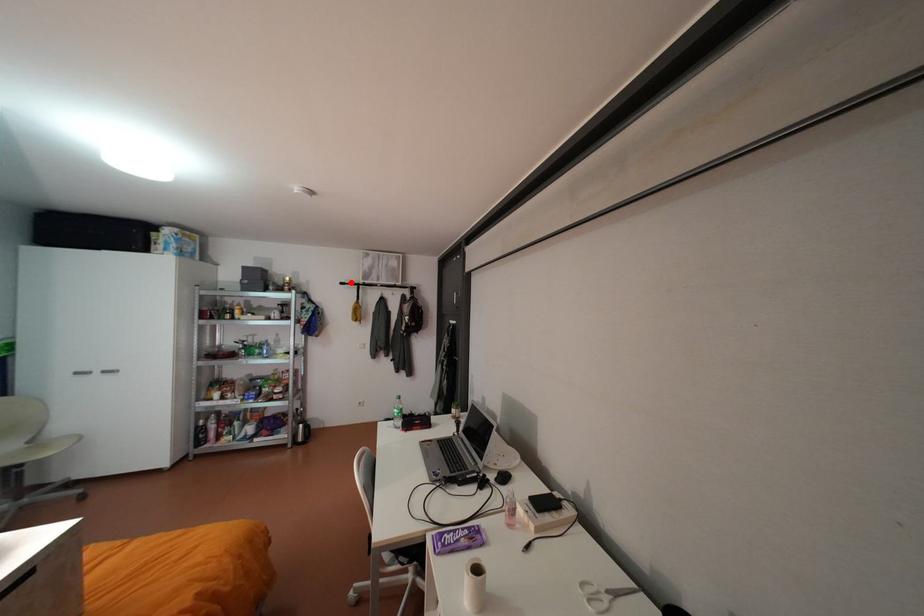
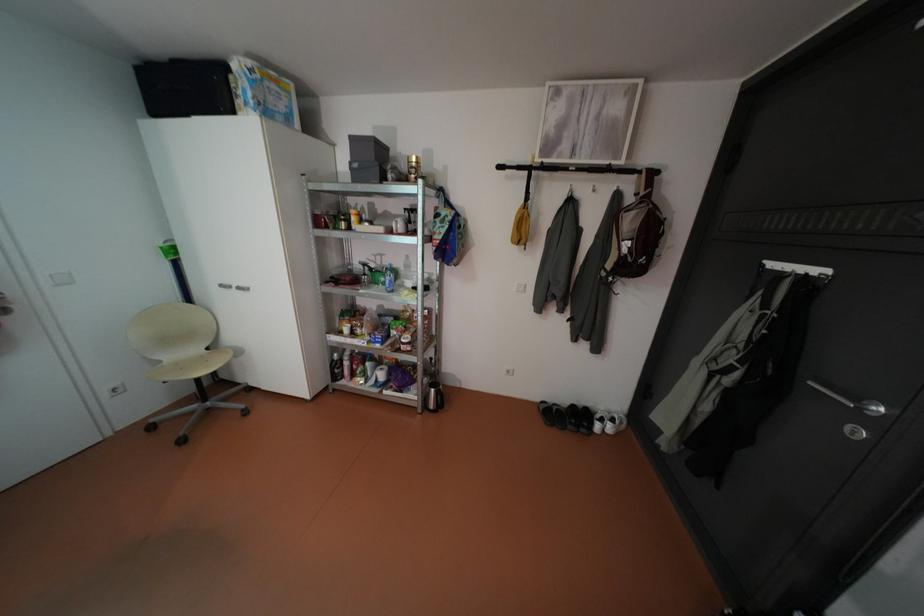
Question: I am providing you with two images of the same scene from different viewpoints. Given a red point in image1, look at the same physical point in image2. Is it:

Choices:
 (A) Closer to the viewpoint
 (B) Farther from the viewpoint

Answer: (A)